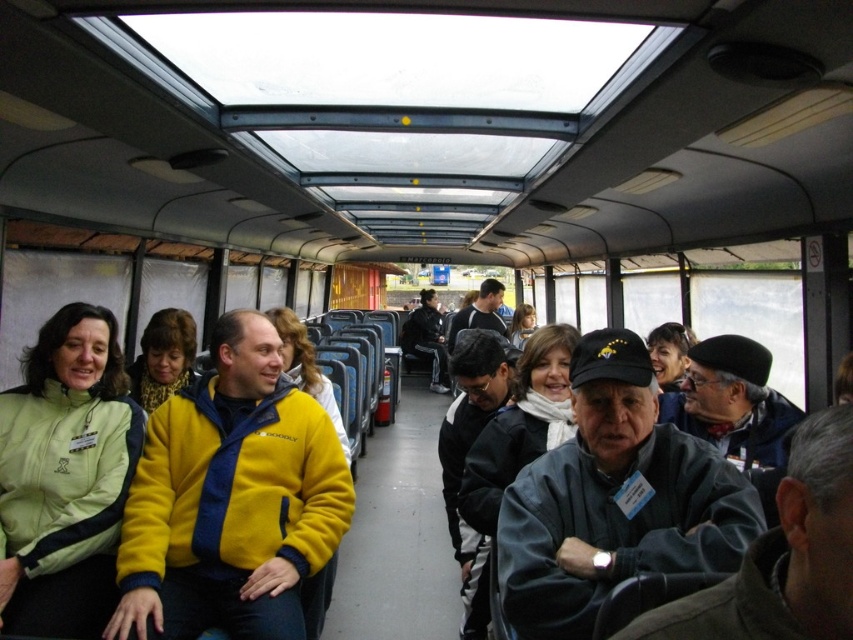
You are a bus passenger trying to move from the back of the bus to the front. There are two people in the aisle wearing a yellow fleece jacket at center and a light green fleece jacket at left. Which person might you have to navigate around first if you want to pass through the aisle?

The light green fleece jacket at left is positioned to the left of the yellow fleece jacket at center, so you would encounter the person wearing the light green fleece jacket at left first as you move forward through the aisle.